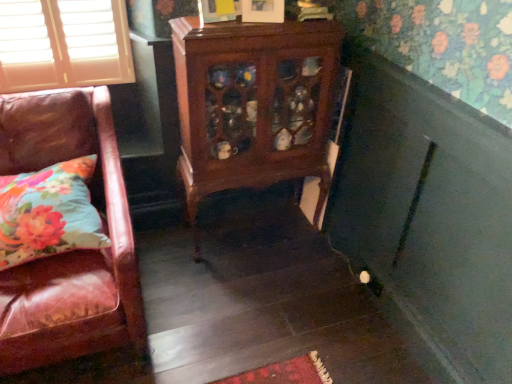
The image size is (512, 384). I want to click on empty space that is ontop of mahogany cabinet at center (from a real-world perspective), so click(x=270, y=22).